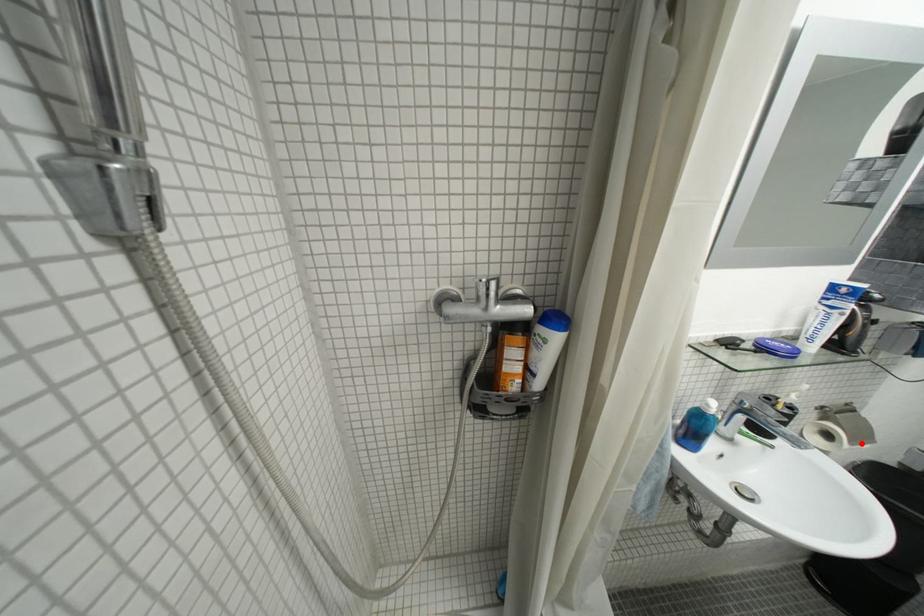
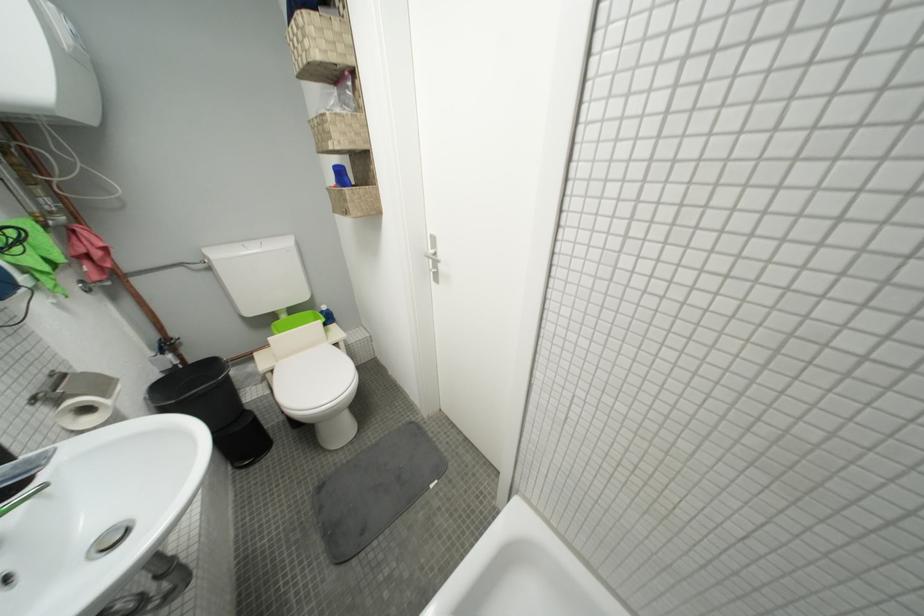
The point at the highlighted location is marked in the first image. Where is the corresponding point in the second image?

(113, 397)